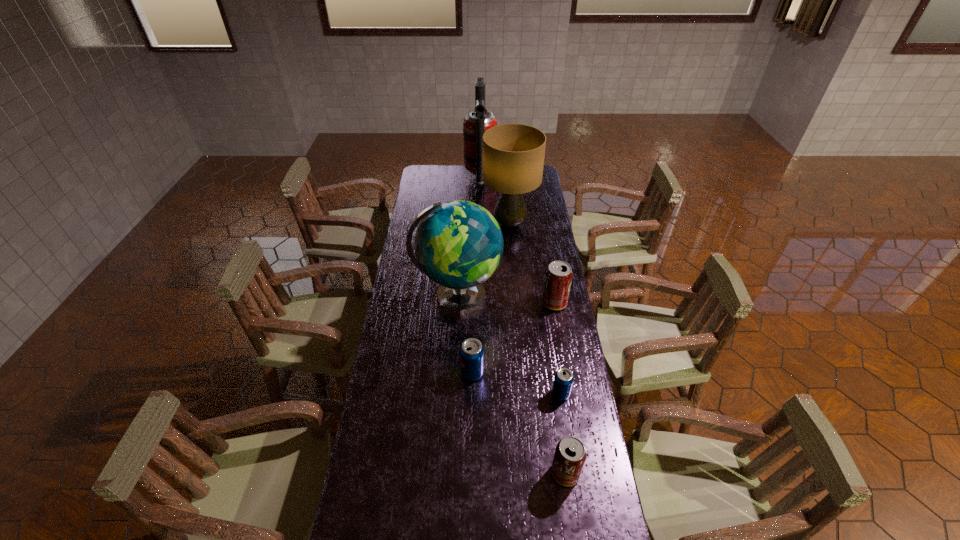
Find the location of a particular element. free space between the farthest object and the smaller red soda can is located at coordinates (522, 326).

This screenshot has width=960, height=540. Identify the location of free space between the bigger red soda can and the nearer blue pop soda. (558, 348).

Where is `object that stands as the fifth closest to the second nearest pop soda`? The width and height of the screenshot is (960, 540). object that stands as the fifth closest to the second nearest pop soda is located at coordinates (513, 154).

Locate an element on the screen. object that is the second nearest to the right blue pop soda is located at coordinates (471, 351).

Select which pop soda is the closest to the tallest pop soda. Please provide its 2D coordinates. Your answer should be formatted as a tuple, i.e. [(x, y)], where the tuple contains the x and y coordinates of a point satisfying the conditions above.

[(563, 380)]

This screenshot has width=960, height=540. I want to click on pop soda that stands as the closest to the nearest object, so click(563, 380).

The image size is (960, 540). Identify the location of the closest red soda can to the farthest object. (558, 276).

I want to click on red soda can that is the nearest to the lampshade, so click(x=558, y=276).

At what (x,y) coordinates should I click in order to perform the action: click on free space that satisfies the following two spatial constraints: 1. on the front surface of the farther blue pop soda; 2. on the left side of the blue globe. Please return your answer as a coordinate pair (x, y). This screenshot has width=960, height=540. Looking at the image, I should click on (453, 373).

At what (x,y) coordinates should I click in order to perform the action: click on vacant area in the image that satisfies the following two spatial constraints: 1. on the back side of the farther blue pop soda; 2. on the front surface of the blue globe. Please return your answer as a coordinate pair (x, y). The image size is (960, 540). Looking at the image, I should click on (473, 297).